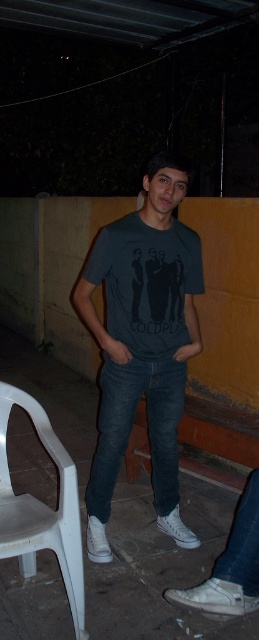
Question: Which object appears closest to the camera in this image?

Choices:
 (A) dark gray t-shirt at center
 (B) dark gray cotton t-shirt at center
 (C) dark blue denim jeans at center

Answer: (A)

Question: Which is farther from the dark gray t-shirt at center?

Choices:
 (A) dark blue denim jeans at center
 (B) white plastic chair at lower left

Answer: (B)

Question: Can you confirm if dark gray t-shirt at center is thinner than dark gray cotton t-shirt at center?

Choices:
 (A) yes
 (B) no

Answer: (B)

Question: Which point appears farthest from the camera in this image?

Choices:
 (A) (167, 422)
 (B) (83, 620)
 (C) (140, 390)
 (D) (183, 294)

Answer: (A)

Question: Does dark gray t-shirt at center have a smaller size compared to dark gray cotton t-shirt at center?

Choices:
 (A) no
 (B) yes

Answer: (A)

Question: Does dark gray t-shirt at center come behind dark gray cotton t-shirt at center?

Choices:
 (A) yes
 (B) no

Answer: (B)